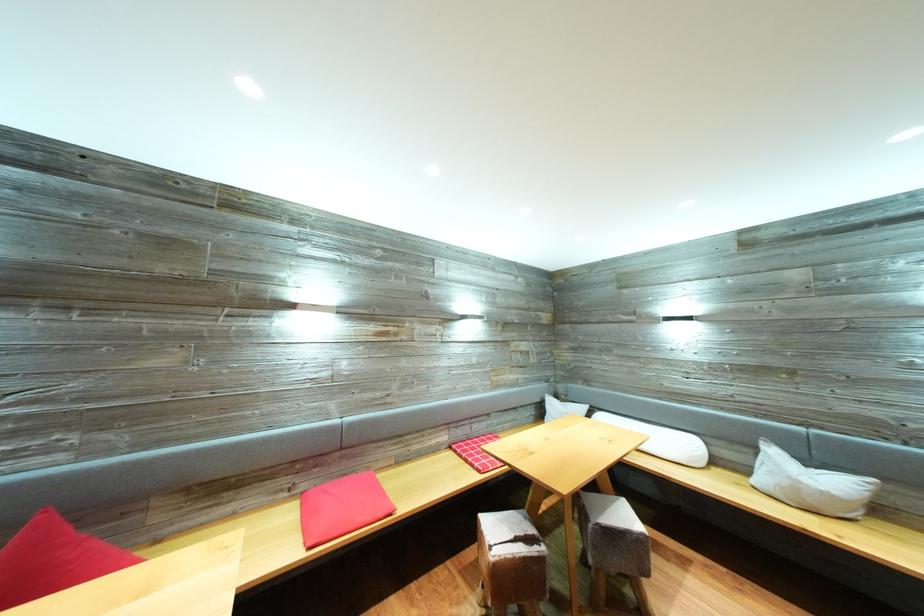
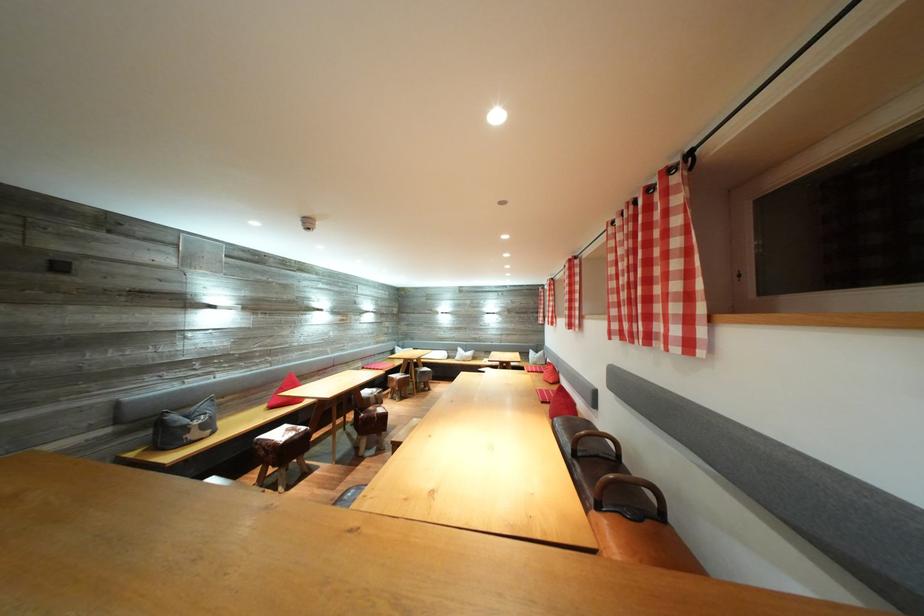
The point at (781, 458) is marked in the first image. Where is the corresponding point in the second image?

(467, 355)